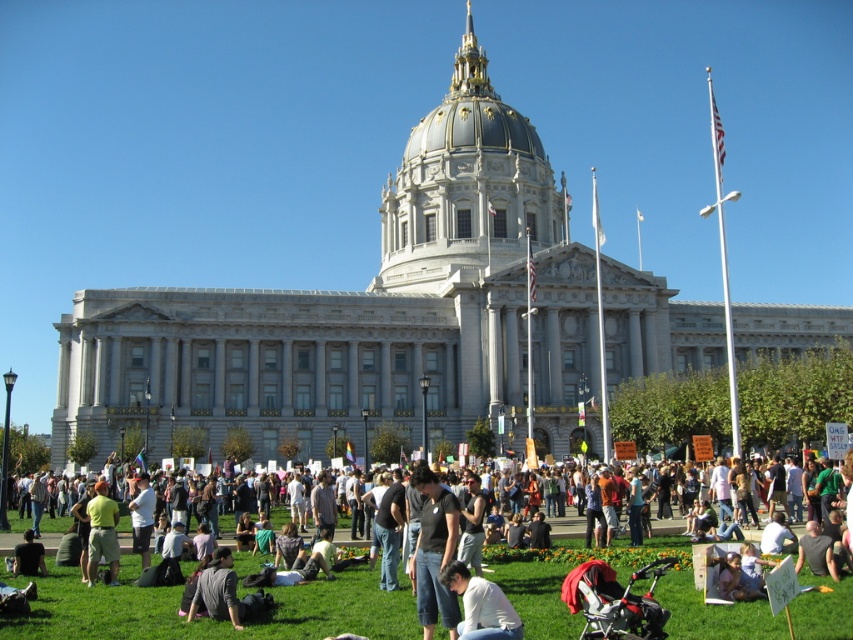
You are standing in front of the grand neoclassical building with a dome and columns. You see a person wearing dark gray jeans at center and another wearing gray cotton shirt at lower center. Which clothing item is nearer to you?

The dark gray jeans at center is closer to the viewer than the gray cotton shirt at lower center.

You are a photographer trying to capture a photo of the dark gray jeans at center and the dark gray shirt at lower left. Since you want to ensure both are clearly visible, which object should you focus on first considering their sizes?

The dark gray jeans at center has a larger width than the dark gray shirt at lower left, so you should focus on the dark gray jeans at center first to ensure clarity since it takes up more space in the frame.

You are standing in front of the grand neoclassical building with a dome and columns. You see a point marked at coordinates (210,620). What object is located at this point?

The point at coordinates (210,620) marks dark gray jeans at center.